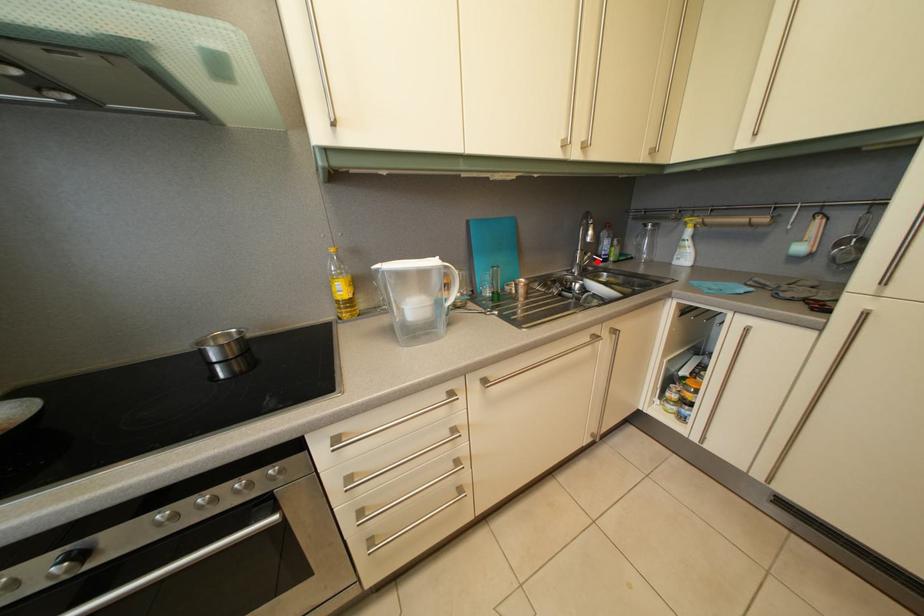
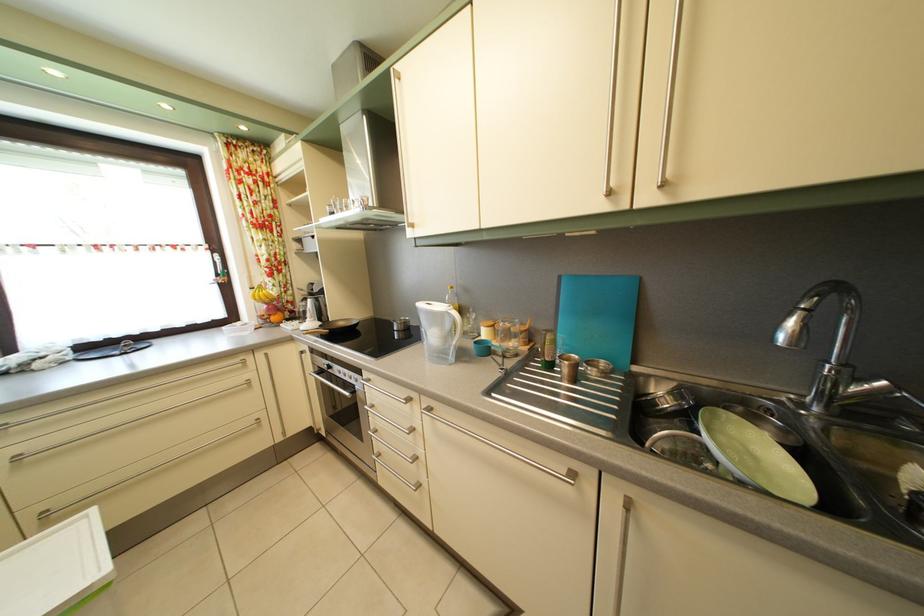
Question: I am providing you with two images of the same scene from different viewpoints. A red point is marked on the first image. At the location where the point appears in image 1, is it still visible in image 2?

Choices:
 (A) Yes
 (B) No

Answer: (A)